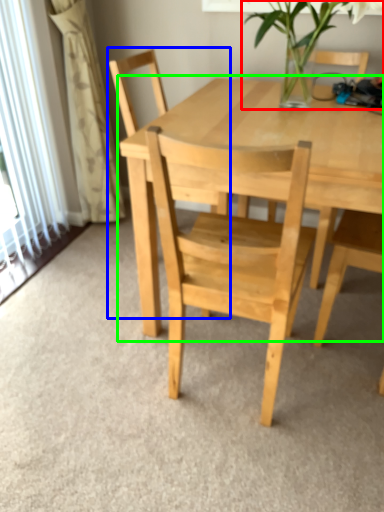
Question: Which is nearer to the houseplant (highlighted by a red box)? chair (highlighted by a blue box) or round table (highlighted by a green box).

Choices:
 (A) chair
 (B) round table

Answer: (B)